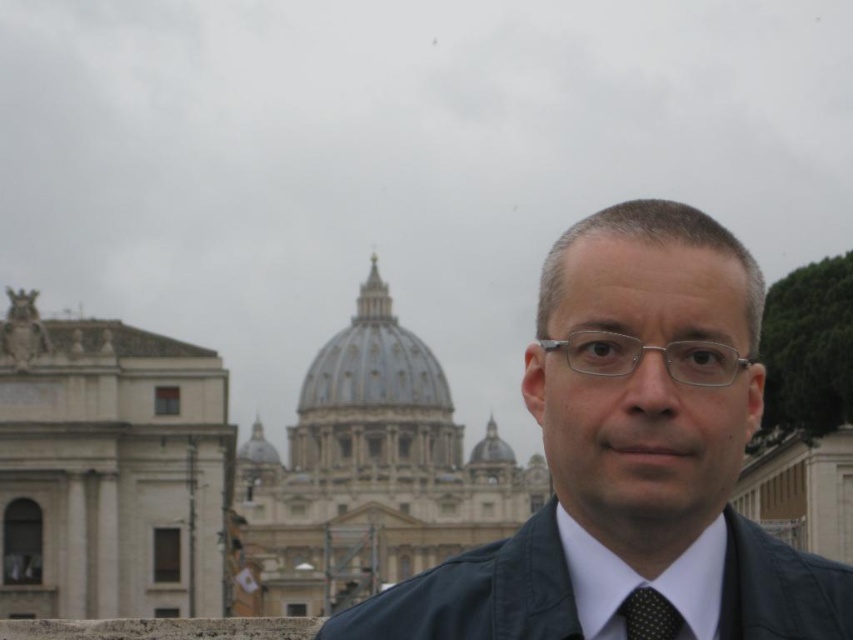
You are a photographer planning to take a portrait of the person wearing the matte black jacket at center and the white smooth dress shirt at center. To ensure both items are visible in the frame, you need to know their arrangement. Which item is positioned to the left of the other?

The matte black jacket at center is positioned to the left of the white smooth dress shirt at center.

You are a photographer standing in front of St. Peter Basilica. You want to take a photo of the person wearing a black dotted fabric tie at center and silver metallic glasses at center. If your camera has a minimum focus distance of 10 feet, will you be able to capture both objects clearly in the same photo?

The silver metallic glasses at center is 12.71 feet from the black dotted fabric tie at center. Since the minimum focus distance is 10 feet, the distance between them is sufficient, so both objects can be captured clearly in the same photo.

You are a fashion designer observing the person in the scene. You need to determine if the black leather jacket at center can be worn over the white smooth dress shirt at center without any adjustments. Based on their sizes, what would you advise?

The black leather jacket at center has a greater height compared to the white smooth dress shirt at center, so it can be worn over the shirt without any adjustments.